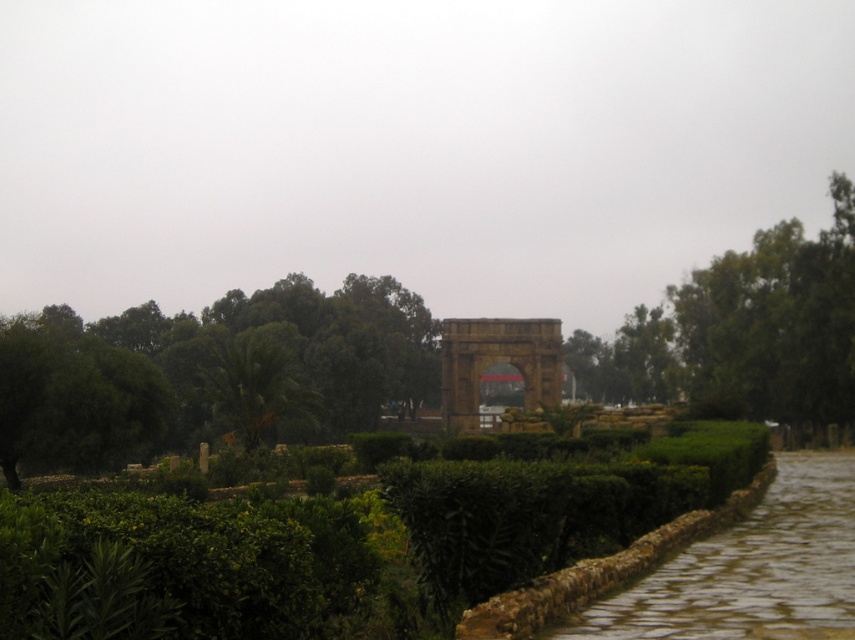
You are a gardener planning to water the green leafy hedge at center and the green leafy tree at left. Based on their positions, which one do you think is closer to the ground?

The green leafy hedge at center is below green leafy tree at left, so the green leafy hedge at center is closer to the ground.

You are a landscape architect designing a garden layout. You need to place a large statue that requires a space wider than the green leafy hedge at center. Can the green leafy tree at upper right provide enough space for the statue?

The green leafy hedge at center is thinner than the green leafy tree at upper right, so the green leafy tree at upper right is wider. Therefore, the space under the green leafy tree at upper right can accommodate the large statue requiring more width than the hedge.

You are a landscape architect designing a garden layout. You need to place a large statue that requires a spacious area. Based on the image, which object between the green leafy hedge at center and the green leafy tree at upper right would you choose to place the statue next to for more space?

The green leafy tree at upper right occupies more space than the green leafy hedge at center, so placing the statue next to the green leafy tree at upper right would provide more space.